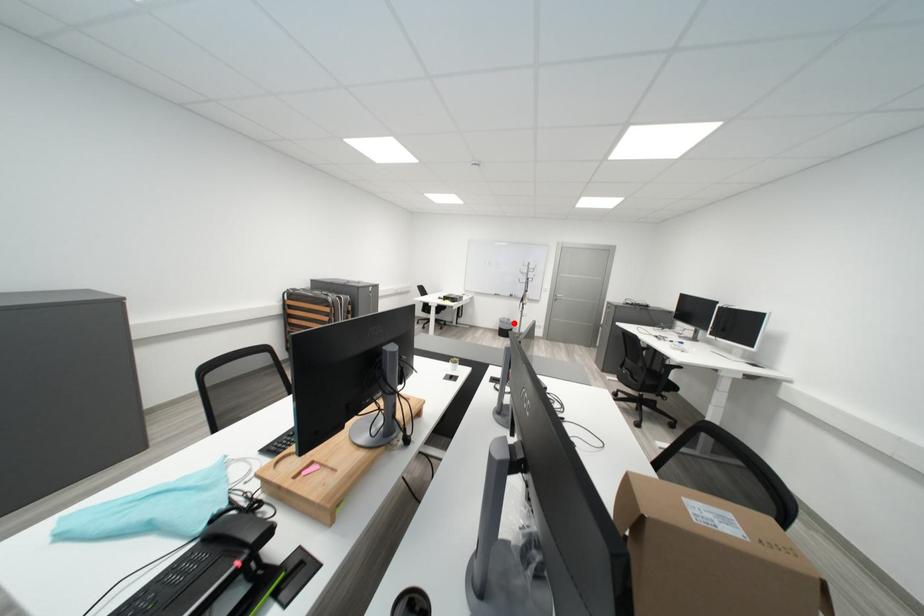
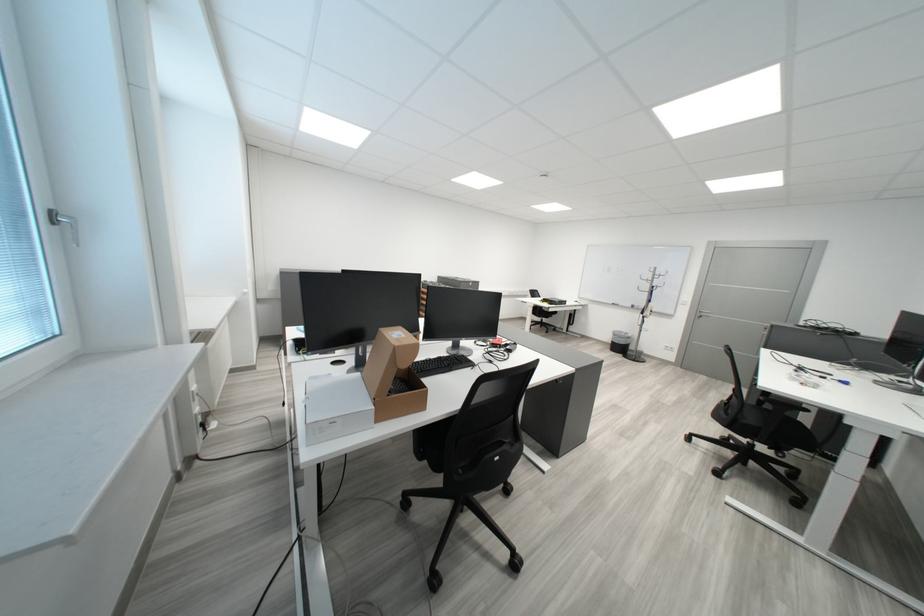
Question: I am providing you with two images of the same scene from different viewpoints. Image1 has a red point marked. In image2, the corresponding 3D location appears at what relative position? Reply with the corresponding letter.

Choices:
 (A) Closer
 (B) Farther

Answer: (B)